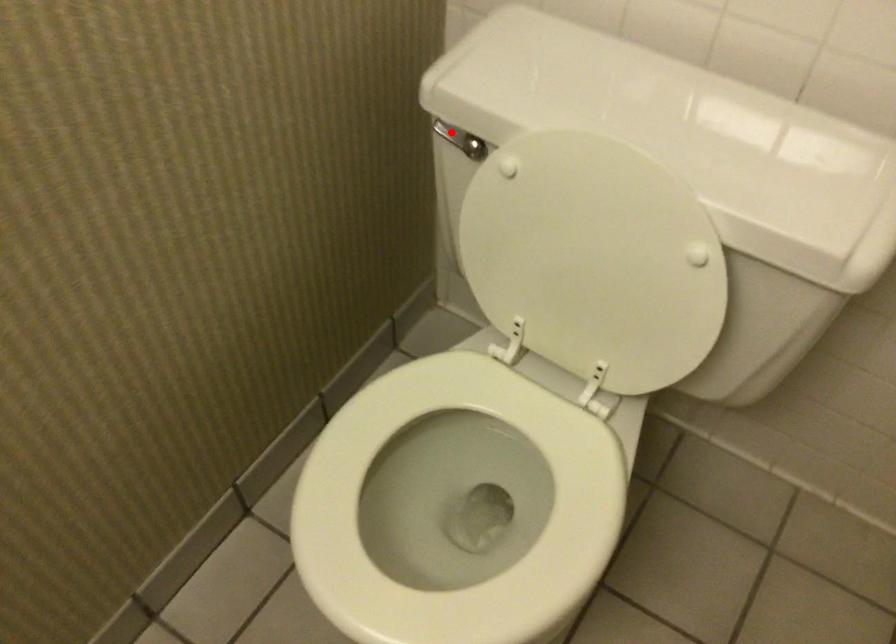
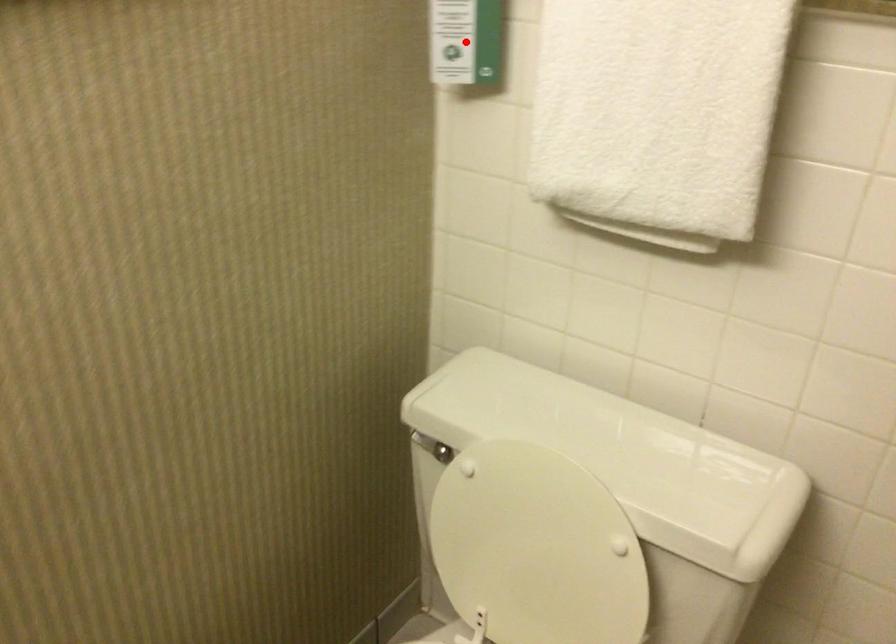
In the scene shown: I am providing you with two images of the same scene from different viewpoints. A red point is marked on the first image and another point is marked on the second image. Is the marked point in image1 the same physical position as the marked point in image2?

No